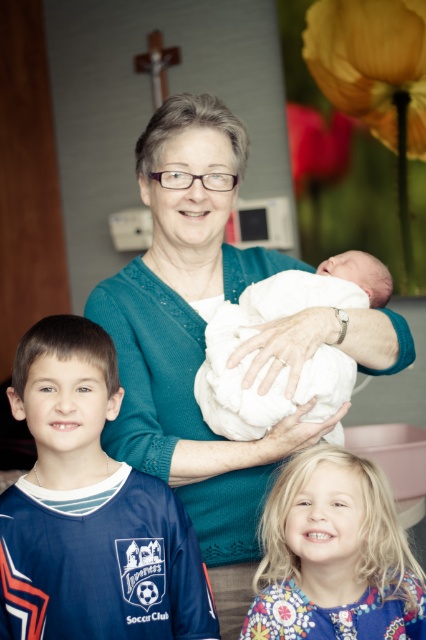
You are a photographer trying to capture a group photo of the elderly woman holding the baby and the two children. You need to ensure all subjects are visible. Given the blue jersey at center and the blonde hair at center, which object should you focus on to ensure the wider subject is properly framed?

The blue jersey at center has a greater width than the blonde hair at center, so focusing on the blue jersey at center will ensure the wider subject is properly framed.

You are standing at the point marked as point (144, 179) and want to hand a gift to the elderly woman holding the newborn baby. Can you reach her without moving from your current position?

The distance between you and the elderly woman holding the newborn baby is 1.38 meters. Since the average human arm length is about 0.7 meters, you cannot reach her without moving closer.

You are a photographer setting up for a family portrait. You need to ensure that all subjects are visible in the photo. The blue jersey at center and the blonde hair at center are both in the frame. Based on their positions, which one is more likely to block the view of the other?

The blue jersey at center is much taller than the blonde hair at center, so the blue jersey at center is more likely to block the view of the blonde hair at center.